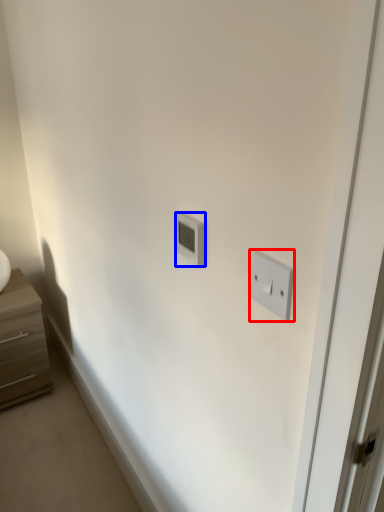
Question: Which point is further to the camera, light switch (highlighted by a red box) or light switch (highlighted by a blue box)?

Choices:
 (A) light switch
 (B) light switch

Answer: (B)